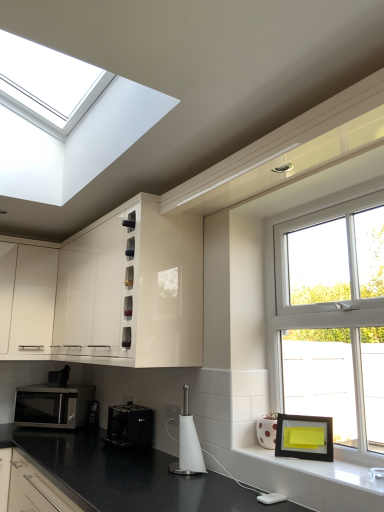
Question: Is silver metallic microwave at lower left thinner than white glossy cabinet at left, positioned as the first cabinetry in left-to-right order?

Choices:
 (A) no
 (B) yes

Answer: (B)

Question: Considering the relative positions of silver metallic microwave at lower left and white glossy cabinet at left, positioned as the first cabinetry in left-to-right order, in the image provided, is silver metallic microwave at lower left to the right of white glossy cabinet at left, positioned as the first cabinetry in left-to-right order, from the viewer's perspective?

Choices:
 (A) no
 (B) yes

Answer: (B)

Question: Is white glossy cabinet at left, acting as the second cabinetry starting from the right, at the back of silver metallic microwave at lower left?

Choices:
 (A) no
 (B) yes

Answer: (A)

Question: From a real-world perspective, is silver metallic microwave at lower left on white glossy cabinet at left, acting as the second cabinetry starting from the right?

Choices:
 (A) no
 (B) yes

Answer: (A)

Question: Can you confirm if silver metallic microwave at lower left is bigger than white glossy cabinet at left, positioned as the first cabinetry in left-to-right order?

Choices:
 (A) yes
 (B) no

Answer: (B)

Question: Is silver metallic microwave at lower left taller than white glossy cabinet at left, positioned as the first cabinetry in left-to-right order?

Choices:
 (A) no
 (B) yes

Answer: (A)

Question: Is white glossy electric outlet at lower center, the 1th electric outlet viewed from the left, not near black matte picture frame at lower right?

Choices:
 (A) yes
 (B) no

Answer: (A)

Question: From the image's perspective, would you say white glossy electric outlet at lower center, which is the 2th electric outlet in right-to-left order, is shown under black matte picture frame at lower right?

Choices:
 (A) no
 (B) yes

Answer: (B)

Question: Can you see white glossy electric outlet at lower center, the 1th electric outlet viewed from the left, touching black matte picture frame at lower right?

Choices:
 (A) no
 (B) yes

Answer: (A)

Question: Is white glossy electric outlet at lower center, the 2th electric outlet when ordered from front to back, behind black matte picture frame at lower right?

Choices:
 (A) no
 (B) yes

Answer: (B)

Question: Is white glossy electric outlet at lower center, the 2th electric outlet when ordered from front to back, looking in the opposite direction of black matte picture frame at lower right?

Choices:
 (A) no
 (B) yes

Answer: (A)

Question: From a real-world perspective, is white glossy electric outlet at lower center, positioned as the 1th electric outlet in back-to-front order, under black matte picture frame at lower right?

Choices:
 (A) yes
 (B) no

Answer: (B)

Question: Considering the relative sizes of glossy white cabinet at upper center, which is the first cabinetry in right-to-left order, and white glossy electric outlet at center, the first electric outlet from the front, in the image provided, is glossy white cabinet at upper center, which is the first cabinetry in right-to-left order, smaller than white glossy electric outlet at center, the first electric outlet from the front,?

Choices:
 (A) no
 (B) yes

Answer: (A)